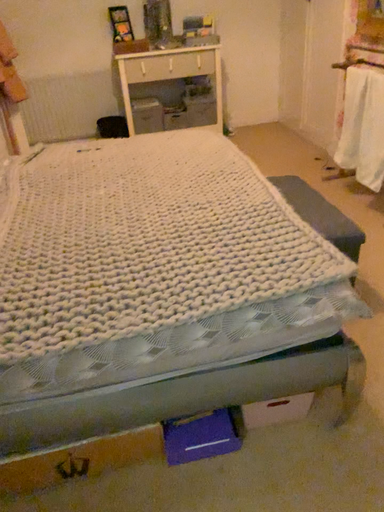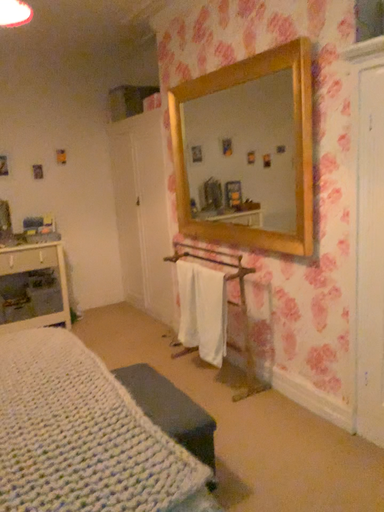
Question: Which way did the camera rotate in the video?

Choices:
 (A) rotated downward
 (B) rotated upward

Answer: (B)